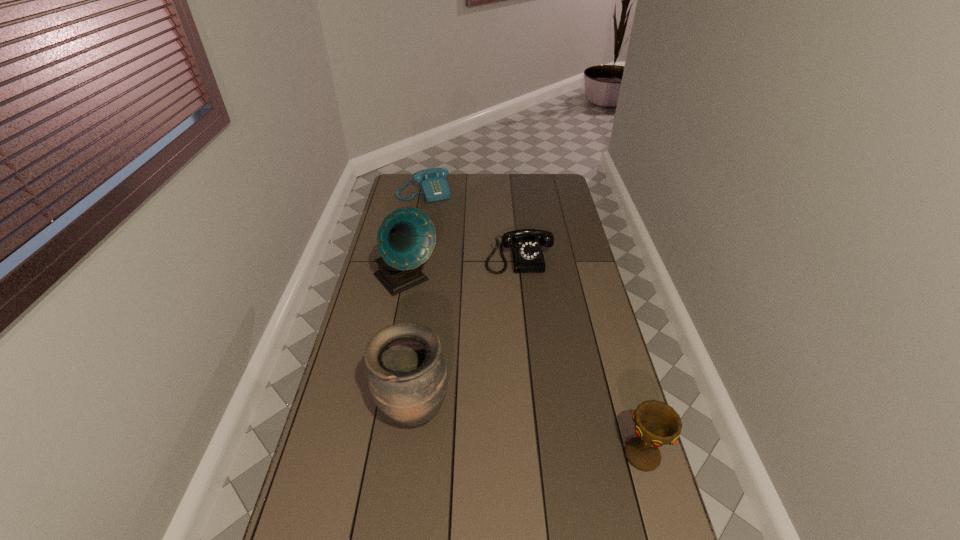
At what (x,y) coordinates should I click in order to perform the action: click on vacant space on the desktop that is between the second tallest object and the chalice and is positioned on the dial of the nearer telephone. Please return your answer as a coordinate pair (x, y). Looking at the image, I should click on (547, 437).

Where is `vacant space on the desktop that is between the urn and the chalice and is positioned on the dial of the shorter telephone`? The width and height of the screenshot is (960, 540). vacant space on the desktop that is between the urn and the chalice and is positioned on the dial of the shorter telephone is located at coordinates (550, 438).

Identify the location of vacant spot on the desktop that is between the urn and the third shortest object and is positioned from the horn of the phonograph_record. (553, 439).